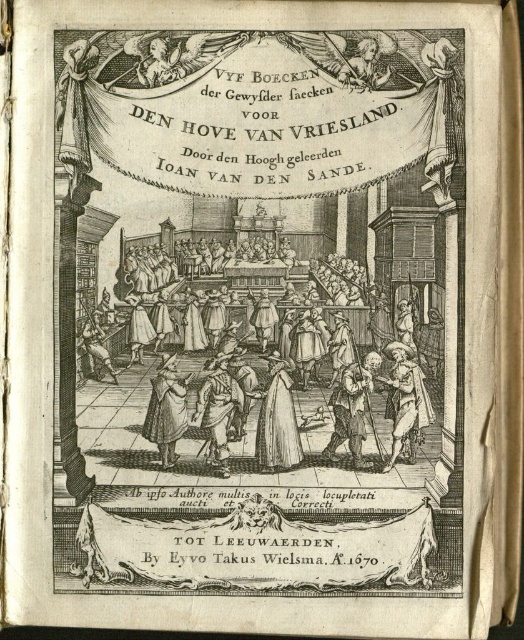
Can you confirm if gold metallic banner at lower center is positioned below brown leather coat at center?

Yes.

Is gold metallic banner at lower center positioned in front of brown leather coat at center?

→ That is True.

Is point (154, 538) closer to camera compared to point (228, 476)?

Yes, point (154, 538) is in front of point (228, 476).

Locate an element on the screen. The width and height of the screenshot is (524, 640). gold metallic banner at lower center is located at coordinates (256, 548).

Can you confirm if wooden chair at center is positioned to the left of smooth white statue at upper center?

Indeed, wooden chair at center is positioned on the left side of smooth white statue at upper center.

Which is more to the left, wooden chair at center or smooth white statue at upper center?

wooden chair at center

Does point (260, 316) lie in front of point (383, 80)?

No, (260, 316) is behind (383, 80).

Locate an element on the screen. The image size is (524, 640). wooden chair at center is located at coordinates (256, 365).

Between point (223, 548) and point (274, 396), which one is positioned in front?

Positioned in front is point (223, 548).

This screenshot has width=524, height=640. In order to click on gold metallic banner at lower center in this screenshot , I will do `click(256, 548)`.

Where is `gold metallic banner at lower center`? The image size is (524, 640). gold metallic banner at lower center is located at coordinates (256, 548).